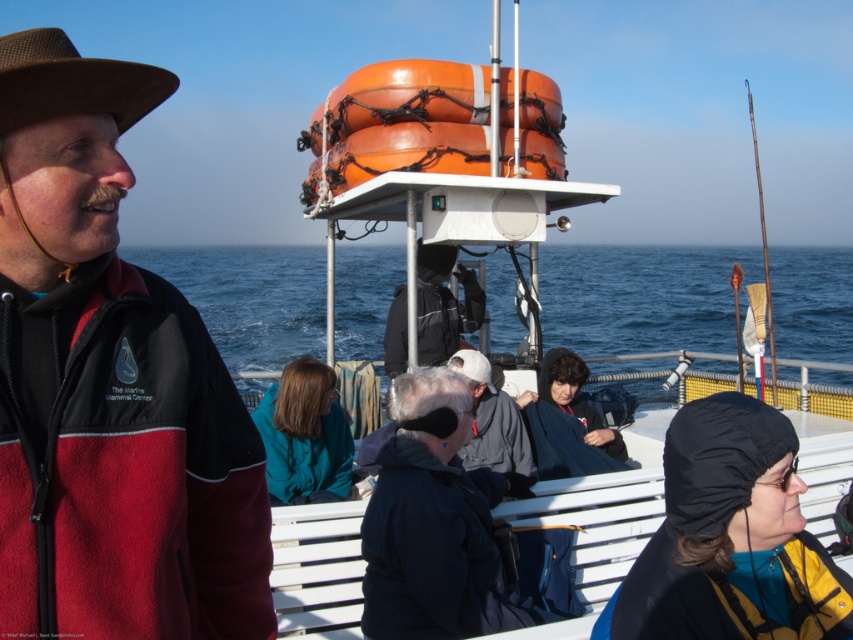
You are a passenger on the boat and want to take a photo of the blue water at center without the dark blue jacket at center appearing in the shot. How can you adjust your position to achieve this?

Since the blue water at center is positioned over the dark blue jacket at center, you can move your position to either the left or right side of the boat to frame the blue water at center while excluding the dark blue jacket at center from the shot.

You are a photographer on the boat and want to take a photo of the brown fleece jacket at left and the black fabric backpack at center. Which object is closer to the camera based on their positions?

The brown fleece jacket at left is positioned under the black fabric backpack at center, so the black fabric backpack at center is closer to the camera.